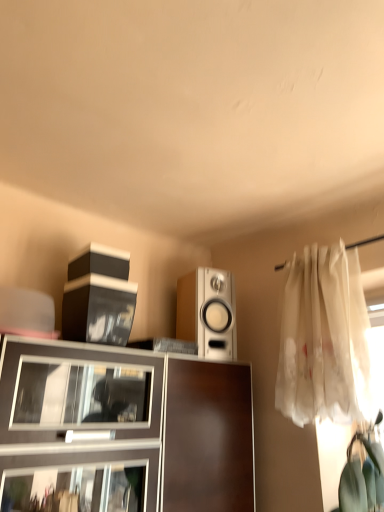
Question: From the image's perspective, relative to white sheer curtain at right, is matte brown cabinet at center above or below?

Choices:
 (A) above
 (B) below

Answer: (B)

Question: Does point (64, 499) appear closer or farther from the camera than point (294, 343)?

Choices:
 (A) farther
 (B) closer

Answer: (B)

Question: Estimate the real-world distances between objects in this image. Which object is closer to the white sheer curtain at right?

Choices:
 (A) white glossy speaker at center
 (B) matte brown cabinet at center

Answer: (A)

Question: Which object is the closest to the white sheer curtain at right?

Choices:
 (A) matte brown cabinet at center
 (B) white glossy speaker at center

Answer: (B)